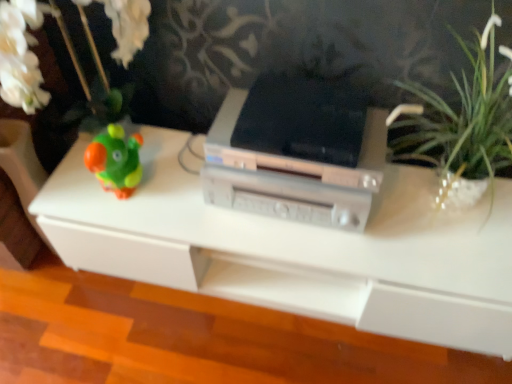
The width and height of the screenshot is (512, 384). Describe the element at coordinates (296, 250) in the screenshot. I see `white plastic table at center` at that location.

You are a GUI agent. You are given a task and a screenshot of the screen. Output one action in this format:
    pyautogui.click(x=<x>, y=<y>)
    Task: Click on the white plastic table at center
    The image size is (512, 384).
    Given the screenshot: What is the action you would take?
    pyautogui.click(x=296, y=250)

Based on the photo, measure the distance between point (251, 192) and camera.

The distance of point (251, 192) from camera is 1.11 meters.

Locate an element on the screen. silver metallic printer at center is located at coordinates (296, 152).

What do you see at coordinates (296, 152) in the screenshot? I see `silver metallic printer at center` at bounding box center [296, 152].

Where is `white plastic table at center`? Image resolution: width=512 pixels, height=384 pixels. white plastic table at center is located at coordinates (296, 250).

Is silver metallic printer at center to the left of white plastic table at center from the viewer's perspective?

Yes.

Consider the image. Between silver metallic printer at center and white plastic table at center, which one is positioned behind?

silver metallic printer at center is behind.

Which is less distant, (332, 96) or (462, 287)?

The point (462, 287) is closer.

From the image's perspective, is silver metallic printer at center over white plastic table at center?

Yes.

From a real-world perspective, is silver metallic printer at center below white plastic table at center?

No, from a real-world perspective, silver metallic printer at center is not under white plastic table at center.

Which of these two, silver metallic printer at center or white plastic table at center, is thinner?

Thinner between the two is silver metallic printer at center.

Between silver metallic printer at center and white plastic table at center, which one has more height?

white plastic table at center is taller.

Who is bigger, silver metallic printer at center or white plastic table at center?

white plastic table at center.

Looking at this image, which is correct: silver metallic printer at center is inside white plastic table at center, or outside of it?

silver metallic printer at center is not enclosed by white plastic table at center.

Is silver metallic printer at center next to white plastic table at center?

No, silver metallic printer at center is not in contact with white plastic table at center.

Does silver metallic printer at center turn towards white plastic table at center?

No, silver metallic printer at center is not facing towards white plastic table at center.

How different are the orientations of silver metallic printer at center and white plastic table at center in degrees?

The facing directions of silver metallic printer at center and white plastic table at center are 0.109 degrees apart.

Identify the location of printer lying behind the white plastic table at center. (296, 152).

Visually, is white plastic table at center positioned to the left or to the right of silver metallic printer at center?

Based on their positions, white plastic table at center is located to the right of silver metallic printer at center.

Between white plastic table at center and silver metallic printer at center, which one is positioned behind?

silver metallic printer at center is more distant.

Considering the positions of point (375, 320) and point (258, 207), is point (375, 320) closer or farther from the camera than point (258, 207)?

Point (375, 320).

From the image's perspective, does white plastic table at center appear higher than silver metallic printer at center?

Incorrect, from the image's perspective, white plastic table at center is lower than silver metallic printer at center.

From a real-world perspective, is white plastic table at center over silver metallic printer at center?

No.

Considering the sizes of white plastic table at center and silver metallic printer at center in the image, is white plastic table at center wider or thinner than silver metallic printer at center?

Clearly, white plastic table at center has more width compared to silver metallic printer at center.

Is white plastic table at center taller or shorter than silver metallic printer at center?

Considering their sizes, white plastic table at center has more height than silver metallic printer at center.

Which of these two, white plastic table at center or silver metallic printer at center, is smaller?

With smaller size is silver metallic printer at center.

Is white plastic table at center inside or outside of silver metallic printer at center?

white plastic table at center is not inside silver metallic printer at center, it's outside.

Consider the image. Would you say white plastic table at center is a long distance from silver metallic printer at center?

No.

Could you tell me if white plastic table at center is facing silver metallic printer at center?

No.

How much distance is there between white plastic table at center and silver metallic printer at center?

8.98 inches.

Identify the location of table that appears below the silver metallic printer at center (from a real-world perspective). The height and width of the screenshot is (384, 512). (296, 250).

Where is `printer above the white plastic table at center (from the image's perspective)`? printer above the white plastic table at center (from the image's perspective) is located at coordinates (296, 152).

Where is `table below the silver metallic printer at center (from a real-world perspective)`? table below the silver metallic printer at center (from a real-world perspective) is located at coordinates (296, 250).